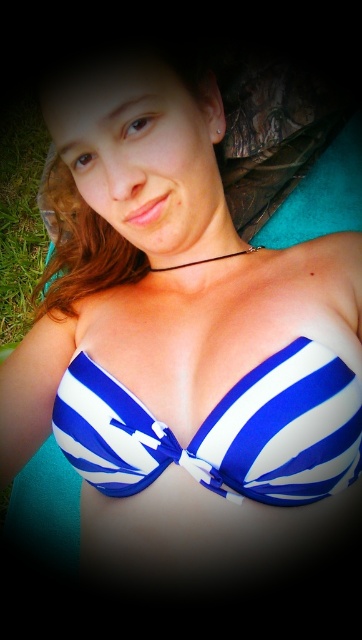
You are a fashion designer observing the scene. You need to determine if the blue striped bikini top at center can be seen from above the green grass at lower left. Can it be seen?

The blue striped bikini top at center is not as tall as the green grass at lower left, so it cannot be fully seen from above the green grass at lower left.

You are a photographer trying to capture the blue striped bikini top at center in a closeup shot. Based on its position at point coordinates, where should you aim your camera relative to the person?

The blue striped bikini top at center is located at coordinates point (222, 429), which means it is positioned slightly to the right and lower than the exact center of the image. To capture it in a closeup, aim your camera slightly to the right and downward from the center point.